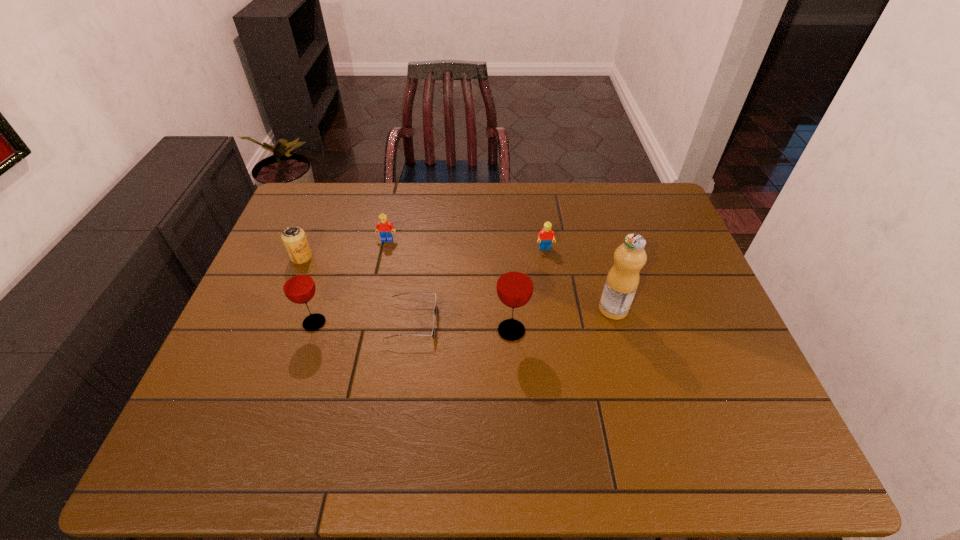
You are a GUI agent. You are given a task and a screenshot of the screen. Output one action in this format:
    pyautogui.click(x=<x>, y=<y>)
    Task: Click on the free space located 0.170m on the front-facing side of the shortest object
    This screenshot has width=960, height=540.
    Given the screenshot: What is the action you would take?
    pyautogui.click(x=501, y=322)

The width and height of the screenshot is (960, 540). In order to click on object present at the left edge in this screenshot , I will do `click(294, 238)`.

Locate an element on the screen. The width and height of the screenshot is (960, 540). vacant space at the far edge of the desktop is located at coordinates (344, 224).

You are a GUI agent. You are given a task and a screenshot of the screen. Output one action in this format:
    pyautogui.click(x=<x>, y=<y>)
    Task: Click on the vacant space at the near edge of the desktop
    
    Given the screenshot: What is the action you would take?
    pyautogui.click(x=486, y=386)

Identify the location of free space at the right edge of the desktop. click(649, 280).

In the image, there is a desktop. Identify the location of blank space at the far left corner. This screenshot has width=960, height=540. (x=326, y=218).

Identify the location of vacant space at the near left corner of the desktop. (208, 404).

Image resolution: width=960 pixels, height=540 pixels. Identify the location of vacant space at the far right corner of the desktop. (656, 208).

At what (x,y) coordinates should I click in order to perform the action: click on free space between the shorter glass and the sixth object from left to right. Please return your answer as a coordinate pair (x, y). Image resolution: width=960 pixels, height=540 pixels. Looking at the image, I should click on pos(429,286).

The image size is (960, 540). I want to click on vacant space in between the leftmost object and the shortest object, so click(357, 289).